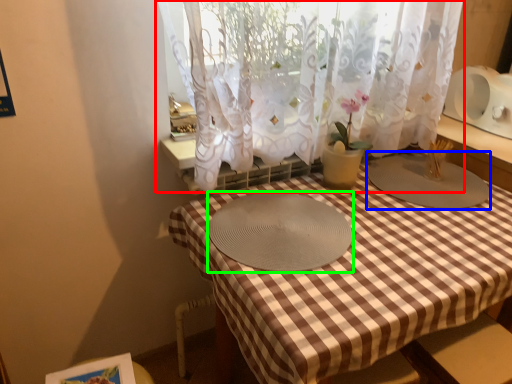
Question: Estimate the real-world distances between objects in this image. Which object is closer to curtain (highlighted by a red box), glass plate (highlighted by a blue box) or glass plate (highlighted by a green box)?

Choices:
 (A) glass plate
 (B) glass plate

Answer: (B)